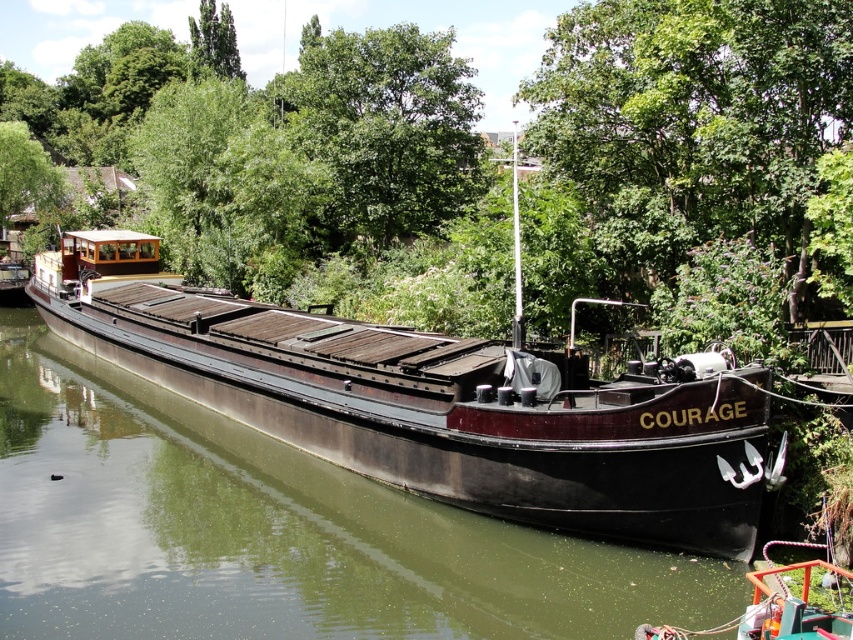
You are standing on the dock next to the dark brown wooden barge at center. Looking towards the green leafy tree at upper center, is the tree above or below the barge?

The dark brown wooden barge at center is below the green leafy tree at upper center, so the tree is above the barge.

You are standing on the dock and want to board the dark brown wooden barge at center. Based on its position, which direction should you walk to reach it?

The dark brown wooden barge at center is located at point [433,403], so you should walk towards the center of the canal to reach it.